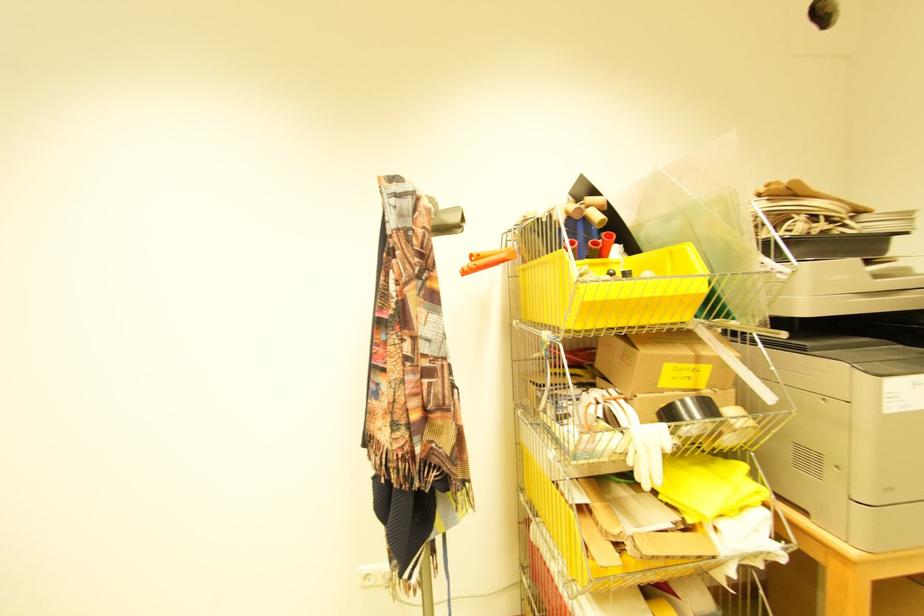
This screenshot has width=924, height=616. Identify the location of wooden handle. (487, 259).